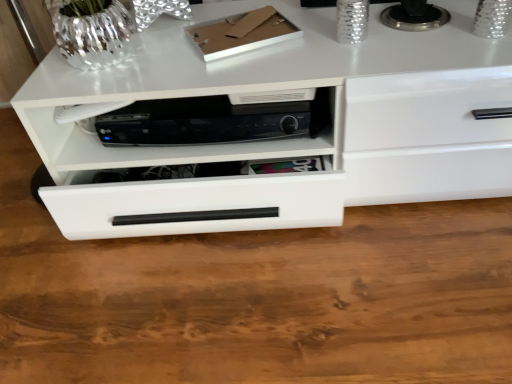
Image resolution: width=512 pixels, height=384 pixels. What do you see at coordinates (286, 139) in the screenshot? I see `white glossy drawer at center` at bounding box center [286, 139].

Identify the location of white glossy drawer at center. (286, 139).

In order to face white glossy drawer at center, should I rotate leftwards or rightwards?

It's best to rotate right around 8.371 degrees.

Consider the image. Measure the distance between black plastic dvd player at center and camera.

black plastic dvd player at center is 32.46 inches away from camera.

Where is `black plastic dvd player at center`? This screenshot has height=384, width=512. black plastic dvd player at center is located at coordinates (208, 121).

What do you see at coordinates (208, 121) in the screenshot? This screenshot has width=512, height=384. I see `black plastic dvd player at center` at bounding box center [208, 121].

Locate an element on the screen. white glossy drawer at center is located at coordinates (286, 139).

Can you confirm if black plastic dvd player at center is positioned to the right of white glossy drawer at center?

No.

Consider the image. Relative to white glossy drawer at center, is black plastic dvd player at center in front or behind?

black plastic dvd player at center is behind white glossy drawer at center.

Is point (216, 105) in front of point (195, 190)?

No, (216, 105) is behind (195, 190).

From the image's perspective, is black plastic dvd player at center located above or below white glossy drawer at center?

black plastic dvd player at center is situated lower than white glossy drawer at center in the image.

From a real-world perspective, which object stands above the other?

black plastic dvd player at center.

Between black plastic dvd player at center and white glossy drawer at center, which one has smaller width?

With smaller width is black plastic dvd player at center.

Who is taller, black plastic dvd player at center or white glossy drawer at center?

With more height is white glossy drawer at center.

Between black plastic dvd player at center and white glossy drawer at center, which one has larger size?

white glossy drawer at center.

Is black plastic dvd player at center completely or partially outside of white glossy drawer at center?

No, black plastic dvd player at center is inside or overlapping with white glossy drawer at center.

Consider the image. Is there a large distance between black plastic dvd player at center and white glossy drawer at center?

They are positioned close to each other.

Is black plastic dvd player at center turned away from white glossy drawer at center?

Yes, black plastic dvd player at center is positioned with its back facing white glossy drawer at center.

How much distance is there between black plastic dvd player at center and white glossy drawer at center?

A distance of 4.78 inches exists between black plastic dvd player at center and white glossy drawer at center.

Locate an element on the screen. the chest of drawers lying in front of the black plastic dvd player at center is located at coordinates (286, 139).

Is white glossy drawer at center to the left of black plastic dvd player at center from the viewer's perspective?

No.

Is white glossy drawer at center closer to camera compared to black plastic dvd player at center?

Yes, it is.

Is point (145, 161) farther from viewer compared to point (304, 111)?

Yes.

From the image's perspective, relative to black plastic dvd player at center, is white glossy drawer at center above or below?

white glossy drawer at center is situated higher than black plastic dvd player at center in the image.

From a real-world perspective, between white glossy drawer at center and black plastic dvd player at center, who is vertically lower?

In real-world perspective, white glossy drawer at center is lower.

Can you confirm if white glossy drawer at center is wider than black plastic dvd player at center?

Yes.

In terms of height, does white glossy drawer at center look taller or shorter compared to black plastic dvd player at center?

Clearly, white glossy drawer at center is taller compared to black plastic dvd player at center.

Between white glossy drawer at center and black plastic dvd player at center, which one has larger size?

Bigger between the two is white glossy drawer at center.

Is black plastic dvd player at center a part of white glossy drawer at center?

Yes, white glossy drawer at center contains black plastic dvd player at center.

Is white glossy drawer at center in contact with black plastic dvd player at center?

white glossy drawer at center and black plastic dvd player at center are not in contact.

Is white glossy drawer at center oriented towards black plastic dvd player at center?

Yes.

What's the angular difference between white glossy drawer at center and black plastic dvd player at center's facing directions?

The angular difference between white glossy drawer at center and black plastic dvd player at center is 0.345 degrees.

This screenshot has height=384, width=512. Identify the location of the chest of drawers above the black plastic dvd player at center (from the image's perspective). (286, 139).

In order to click on chest of drawers below the black plastic dvd player at center (from a real-world perspective) in this screenshot , I will do `click(286, 139)`.

In order to click on home appliance below the white glossy drawer at center (from the image's perspective) in this screenshot , I will do (x=208, y=121).